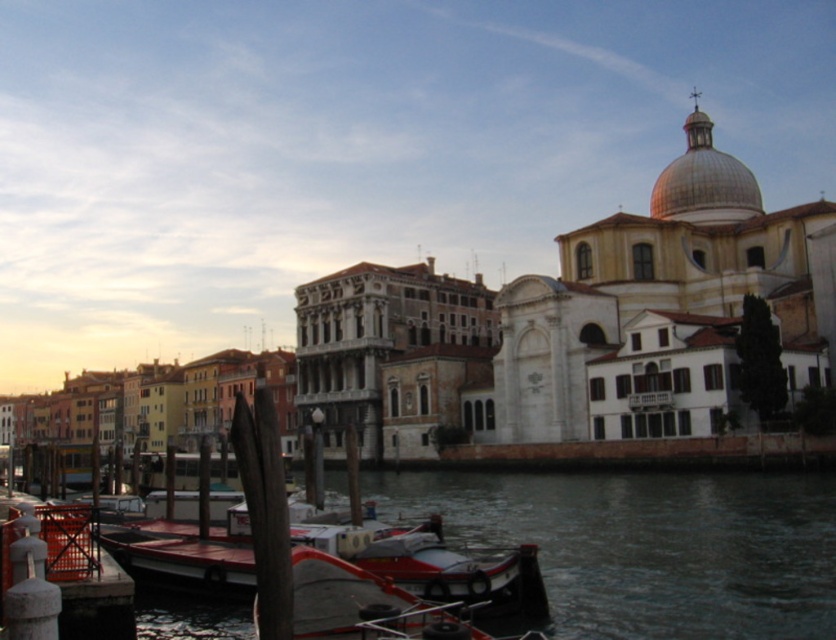
You are a tourist in Venice and want to take a photo of the smooth concrete canal at lower center and the orange plastic dock at lower left. Which object should you focus on first if you want to capture both in a single frame without moving the camera?

The smooth concrete canal at lower center is bigger than the orange plastic dock at lower left, so you should focus on the smooth concrete canal at lower center first to ensure it fits properly in the frame before adjusting for the smaller orange plastic dock at lower left.

You are a tour guide leading a group of visitors along the canal in Venice. You want to point out the distance between the smooth concrete canal at lower center and the white glossy boat at lower center. How far apart are they?

The smooth concrete canal at lower center is 17.34 meters from the white glossy boat at lower center.

You are a tourist standing on the orange plastic dock at lower left and want to walk to the smooth concrete canal at lower center. Which direction should you move to reach it?

The smooth concrete canal at lower center is to the right of the orange plastic dock at lower left, so you should move to your right to reach it.